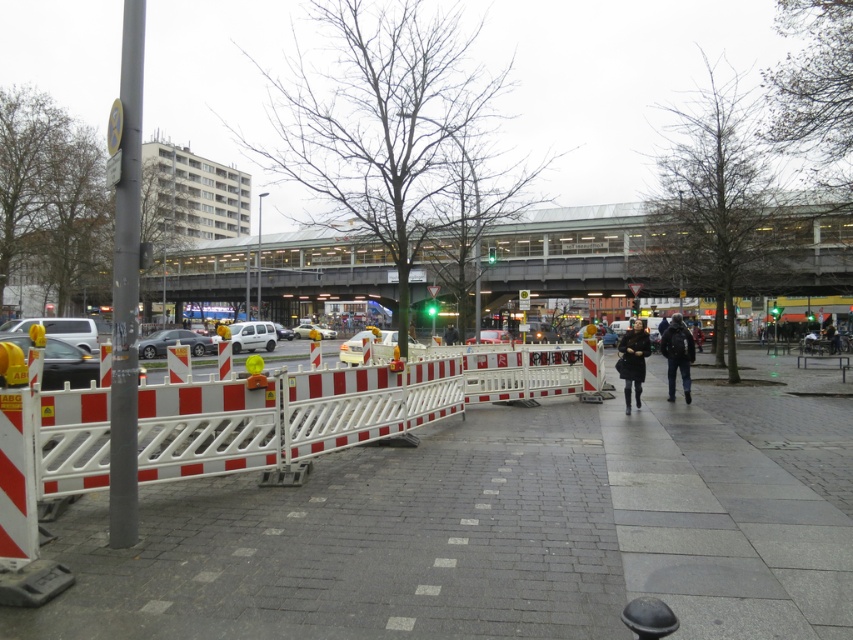
Question: Estimate the real-world distances between objects in this image. Which object is closer to the black fur coat at center?

Choices:
 (A) dark blue backpack at center
 (B) gray concrete pavement at center

Answer: (A)

Question: Which point appears farthest from the camera in this image?

Choices:
 (A) (669, 372)
 (B) (245, 508)
 (C) (265, 332)

Answer: (C)

Question: Does dark blue backpack at center appear on the left side of silver metallic car at center?

Choices:
 (A) yes
 (B) no

Answer: (B)

Question: Can you confirm if black fur coat at center is positioned to the left of matte silver car at center?

Choices:
 (A) no
 (B) yes

Answer: (A)

Question: Is white plastic car at center further to camera compared to matte silver car at center?

Choices:
 (A) yes
 (B) no

Answer: (B)

Question: Based on their relative distances, which object is nearer to the dark blue backpack at center?

Choices:
 (A) gray concrete pavement at center
 (B) white matte van at center
 (C) black fur coat at center

Answer: (C)